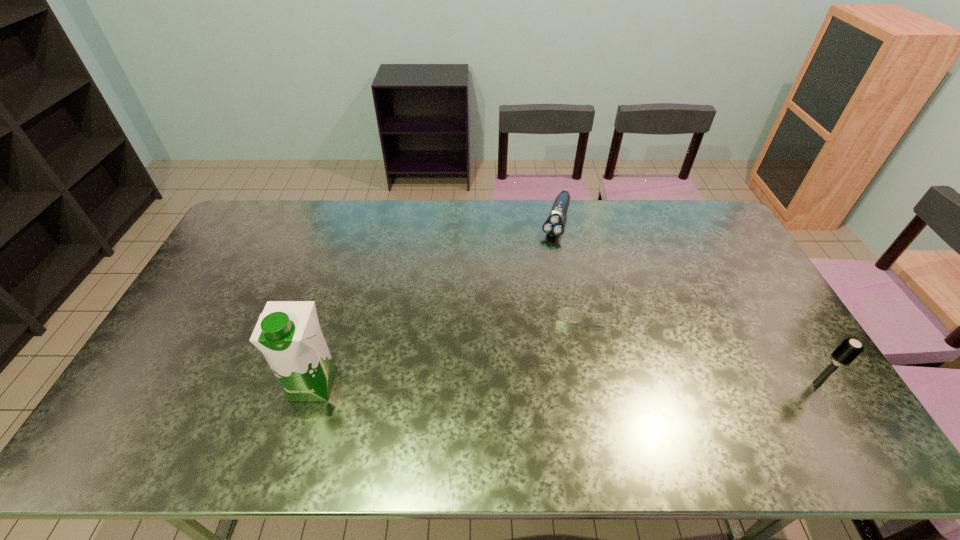
At what (x,y) coordinates should I click in order to perform the action: click on free space that is in between the electric shaver and the hairbrush. Please return your answer as a coordinate pair (x, y). Image resolution: width=960 pixels, height=540 pixels. Looking at the image, I should click on (686, 302).

Where is `empty space that is in between the electric shaver and the second tallest object`? empty space that is in between the electric shaver and the second tallest object is located at coordinates (686, 302).

Identify the location of free space between the shortest object and the tallest object. (450, 343).

This screenshot has width=960, height=540. Identify the location of free space that is in between the soya milk and the hairbrush. (565, 383).

Find the location of a particular element. The image size is (960, 540). vacant region between the spectacles and the leftmost object is located at coordinates (450, 343).

Find the location of a particular element. The image size is (960, 540). object that is the third closest to the third shortest object is located at coordinates (288, 333).

Identify the location of object that is the third closest to the electric shaver. (288, 333).

At what (x,y) coordinates should I click in order to perform the action: click on vacant space that satisfies the following two spatial constraints: 1. on the front side of the spectacles; 2. on the right side of the third tallest object. Please return your answer as a coordinate pair (x, y). Looking at the image, I should click on (571, 303).